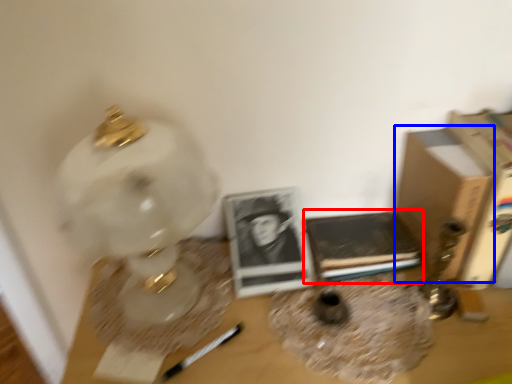
Question: Among these objects, which one is nearest to the camera, paperback book (highlighted by a red box) or cardboard box (highlighted by a blue box)?

Choices:
 (A) paperback book
 (B) cardboard box

Answer: (B)